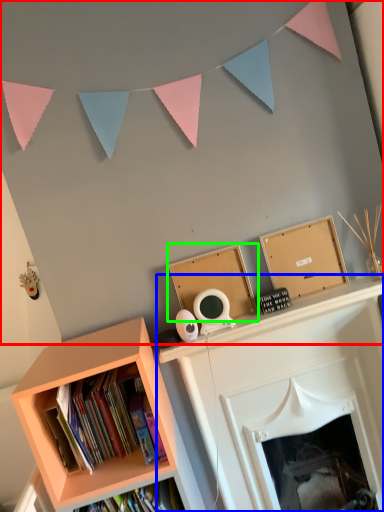
Question: Which object is positioned farthest from backdrop (highlighted by a red box)? Select from fireplace (highlighted by a blue box) and cardboard box (highlighted by a green box).

Choices:
 (A) fireplace
 (B) cardboard box

Answer: (A)